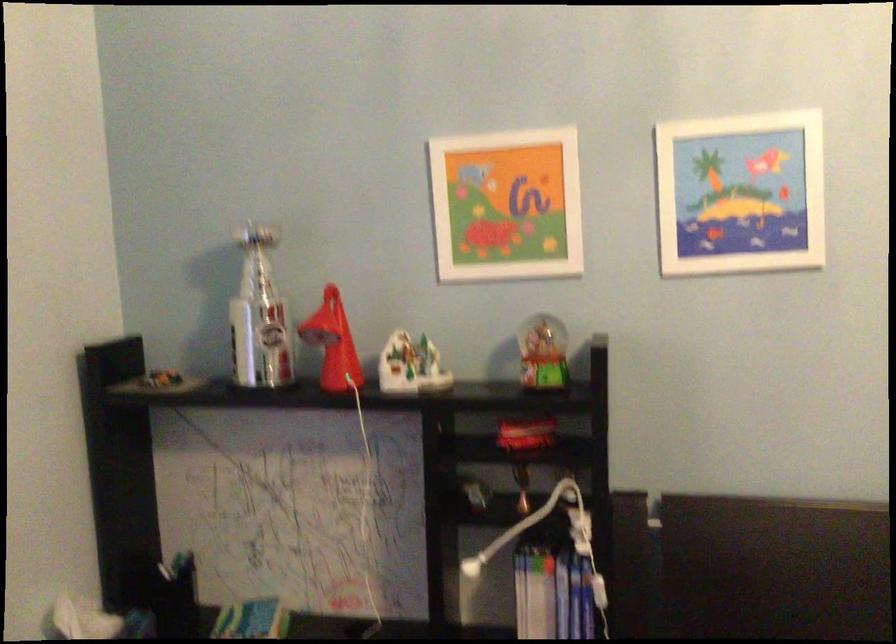
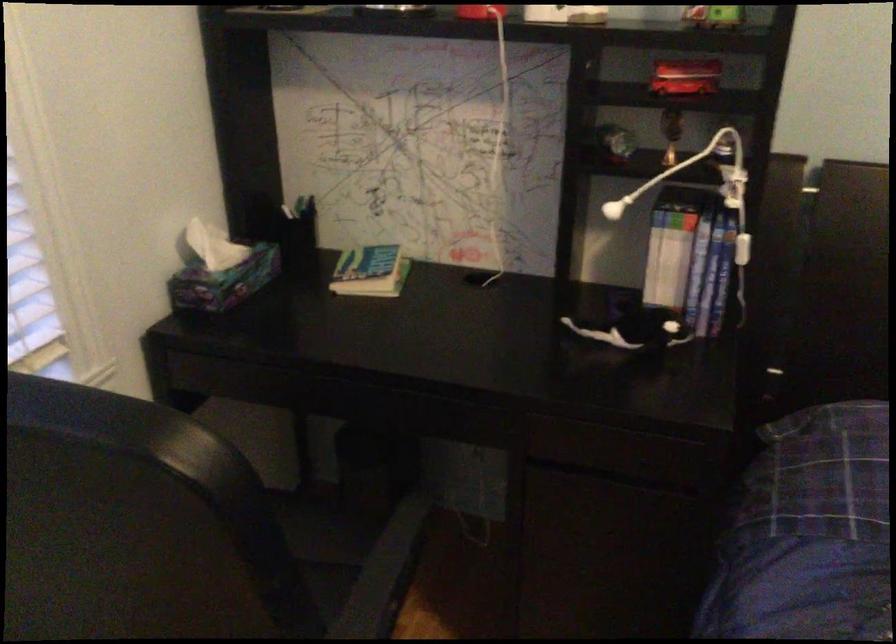
Locate, in the second image, the point that corresponds to (x=547, y=379) in the first image.

(713, 17)